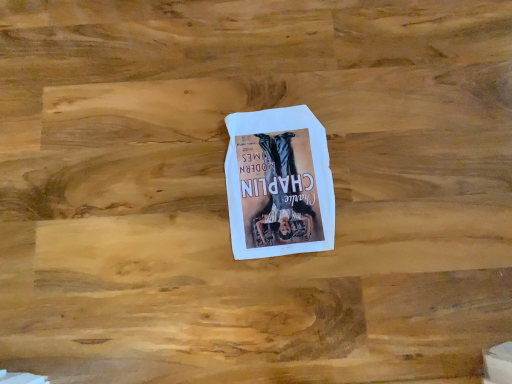
Image resolution: width=512 pixels, height=384 pixels. I want to click on vacant area to the right of white paper at center, so click(x=389, y=173).